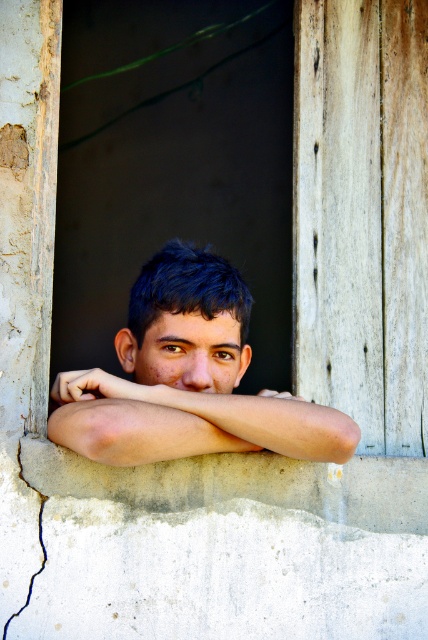
In the scene shown: Is smooth skin face at center thinner than smooth skin arm at center?

Yes.

How distant is smooth skin face at center from smooth skin arm at center?

smooth skin face at center is 0.90 inches from smooth skin arm at center.

Does point (246, 406) lie behind point (249, 429)?

No, (246, 406) is closer to viewer.

The image size is (428, 640). Identify the location of smooth skin face at center. (187, 378).